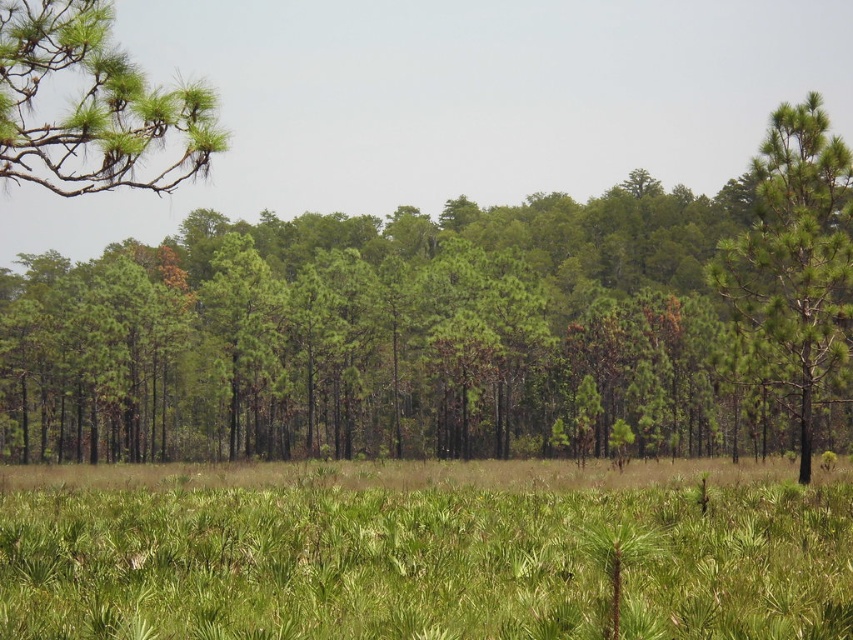
How much distance is there between green leafy tree at center and green needle-like leaves at upper left?

The distance of green leafy tree at center from green needle-like leaves at upper left is 72.88 meters.

Is point (645, 308) positioned behind point (134, 176)?

Yes, point (645, 308) is farther from viewer.

The image size is (853, 640). Describe the element at coordinates (456, 326) in the screenshot. I see `green leafy tree at center` at that location.

Where is `green leafy tree at center`? The height and width of the screenshot is (640, 853). green leafy tree at center is located at coordinates (456, 326).

Can you confirm if green needle-like leaves at upper left is positioned to the left of green textured pine tree at right?

Indeed, green needle-like leaves at upper left is positioned on the left side of green textured pine tree at right.

Is point (149, 132) more distant than point (840, 236)?

That is False.

Image resolution: width=853 pixels, height=640 pixels. I want to click on green needle-like leaves at upper left, so click(91, 106).

Where is `green needle-like leaves at upper left`? The image size is (853, 640). green needle-like leaves at upper left is located at coordinates (91, 106).

Does green leafy grass at center appear over green textured pine tree at right?

Actually, green leafy grass at center is below green textured pine tree at right.

From the picture: Who is more distant from viewer, (799, 547) or (746, 259)?

Point (746, 259)

The width and height of the screenshot is (853, 640). What are the coordinates of `green leafy grass at center` in the screenshot? It's located at (425, 550).